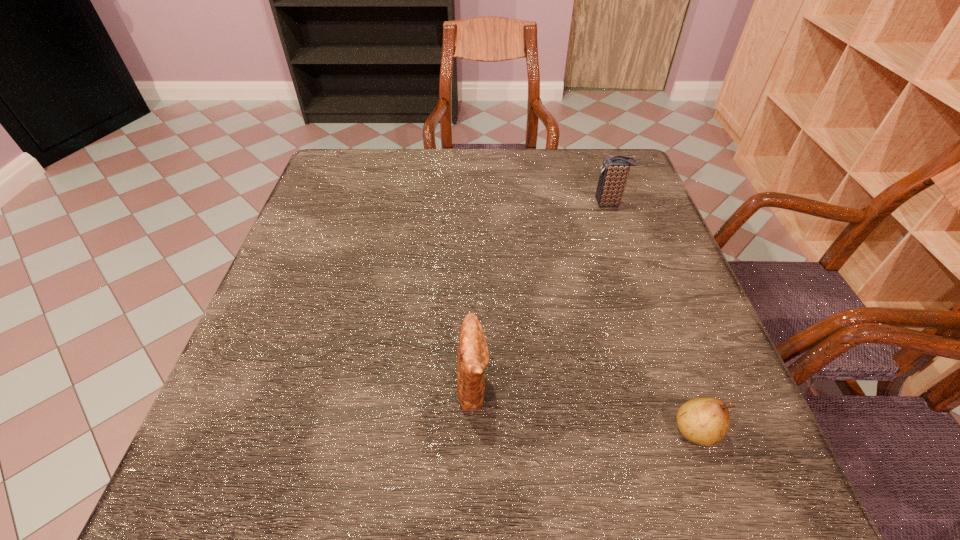
Image resolution: width=960 pixels, height=540 pixels. I want to click on vacant area that lies between the shortest object and the nearer clutch bag, so click(585, 408).

The width and height of the screenshot is (960, 540). What are the coordinates of `vacant space in between the nearer clutch bag and the right clutch bag` in the screenshot? It's located at (541, 294).

This screenshot has height=540, width=960. I want to click on free space between the pear and the right clutch bag, so click(653, 317).

The image size is (960, 540). Identify the location of free spot between the right clutch bag and the pear. (653, 317).

Locate an element on the screen. The height and width of the screenshot is (540, 960). free spot between the pear and the leftmost object is located at coordinates (585, 408).

At what (x,y) coordinates should I click in order to perform the action: click on free space between the shortest object and the left clutch bag. Please return your answer as a coordinate pair (x, y). Looking at the image, I should click on (585, 408).

Find the location of a particular element. free space that is in between the pear and the farther clutch bag is located at coordinates (653, 317).

Where is `free space between the right clutch bag and the pear`? free space between the right clutch bag and the pear is located at coordinates (653, 317).

Identify the location of free area in between the farthest object and the nearer clutch bag. The height and width of the screenshot is (540, 960). (541, 294).

In order to click on the closest object to the left clutch bag in this screenshot , I will do `click(704, 421)`.